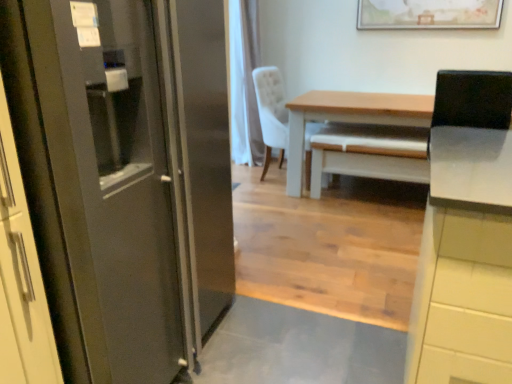
Question: Considering the positions of point (426, 208) and point (370, 13), is point (426, 208) closer or farther from the camera than point (370, 13)?

Choices:
 (A) farther
 (B) closer

Answer: (B)

Question: From a real-world perspective, is white glossy cabinet at upper right above or below wooden framed artwork at upper center?

Choices:
 (A) above
 (B) below

Answer: (B)

Question: Considering the real-world distances, which object is farthest from the light brown wooden table at center?

Choices:
 (A) satin metallic refrigerator at left
 (B) wooden framed artwork at upper center
 (C) white fabric chair at center
 (D) white glossy cabinet at upper right

Answer: (A)

Question: Based on their relative distances, which object is nearer to the wooden framed artwork at upper center?

Choices:
 (A) light brown wooden table at center
 (B) white glossy cabinet at upper right
 (C) white fabric chair at center
 (D) satin metallic refrigerator at left

Answer: (A)